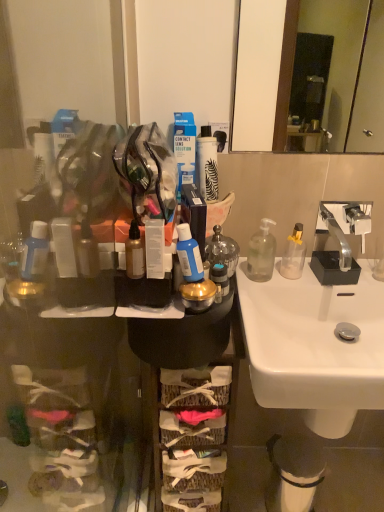
Question: Is white matte spray can at center, the 1th toiletry from the top, positioned behind silver metallic faucet at upper right?

Choices:
 (A) yes
 (B) no

Answer: (A)

Question: Is white matte spray can at center, the second toiletry in the front-to-back sequence, oriented away from silver metallic faucet at upper right?

Choices:
 (A) yes
 (B) no

Answer: (B)

Question: Considering the relative sizes of white matte spray can at center, the second toiletry in the front-to-back sequence, and silver metallic faucet at upper right in the image provided, is white matte spray can at center, the second toiletry in the front-to-back sequence, smaller than silver metallic faucet at upper right?

Choices:
 (A) no
 (B) yes

Answer: (B)

Question: From the image's perspective, does white matte spray can at center, which is the 1th toiletry from back to front, appear higher than silver metallic faucet at upper right?

Choices:
 (A) no
 (B) yes

Answer: (B)

Question: Does white matte spray can at center, the second toiletry when ordered from bottom to top, turn towards silver metallic faucet at upper right?

Choices:
 (A) yes
 (B) no

Answer: (B)

Question: From a real-world perspective, is transparent plastic bottle at sink, which is counted as the fourth bottle, starting from the left, above or below woven fabric basket at center?

Choices:
 (A) below
 (B) above

Answer: (B)

Question: Considering the positions of point (281, 271) and point (175, 458), is point (281, 271) closer or farther from the camera than point (175, 458)?

Choices:
 (A) closer
 (B) farther

Answer: (A)

Question: In terms of width, does transparent plastic bottle at sink, which is counted as the fourth bottle, starting from the left, look wider or thinner when compared to woven fabric basket at center?

Choices:
 (A) thin
 (B) wide

Answer: (A)

Question: Looking at the image, does transparent plastic bottle at sink, arranged as the first bottle when viewed from the right, seem bigger or smaller compared to woven fabric basket at center?

Choices:
 (A) small
 (B) big

Answer: (A)

Question: Would you say white glossy sink at center is inside or outside metallic gold container at center, which appears as the second toiletry when viewed from the back?

Choices:
 (A) inside
 (B) outside

Answer: (B)

Question: Is point (297, 289) closer or farther from the camera than point (213, 281)?

Choices:
 (A) closer
 (B) farther

Answer: (B)

Question: Would you say white glossy sink at center is to the left or to the right of metallic gold container at center, which is the first toiletry in front-to-back order, in the picture?

Choices:
 (A) left
 (B) right

Answer: (B)

Question: From the image's perspective, is white glossy sink at center above or below metallic gold container at center, which is the first toiletry in front-to-back order?

Choices:
 (A) below
 (B) above

Answer: (A)

Question: Based on their sizes in the image, would you say blue matte bottle at center is bigger or smaller than transparent plastic soap dispenser at right, which ranks as the 3th bottle in left-to-right order?

Choices:
 (A) big
 (B) small

Answer: (B)

Question: In terms of height, does blue matte bottle at center look taller or shorter compared to transparent plastic soap dispenser at right, which ranks as the 3th bottle in left-to-right order?

Choices:
 (A) short
 (B) tall

Answer: (A)